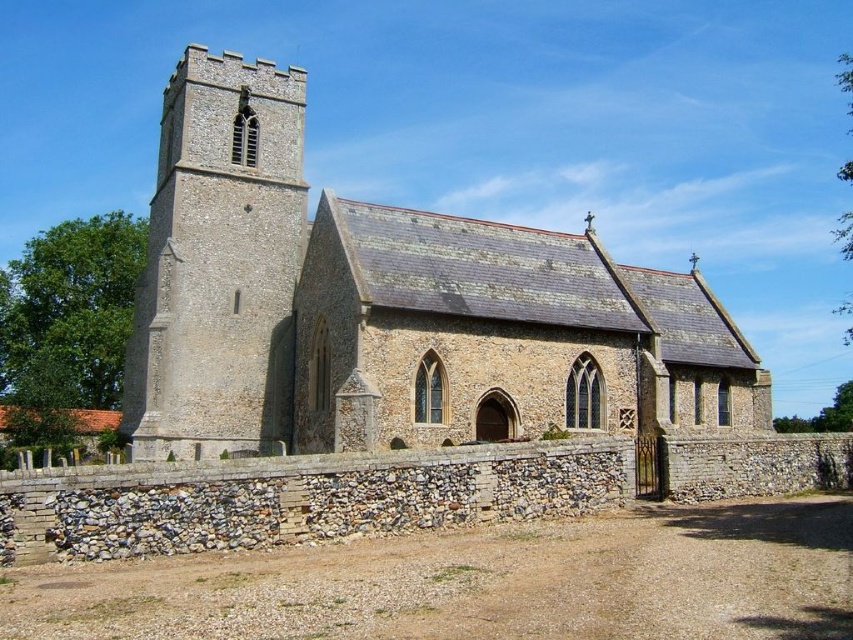
Which of these two, brown stone church at center or stone tower at upper left, stands taller?

With more height is brown stone church at center.

Between point (664, 324) and point (260, 307), which one is positioned behind?

Point (664, 324)

Is point (506, 378) positioned behind point (132, 449)?

No, it is in front of (132, 449).

Find the location of `brown stone church at center`. brown stone church at center is located at coordinates (389, 307).